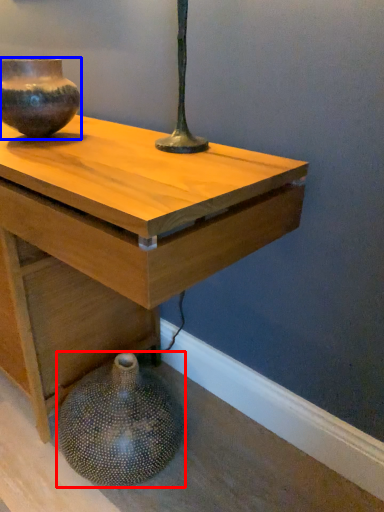
Question: Among these objects, which one is nearest to the camera, vase (highlighted by a red box) or vase (highlighted by a blue box)?

Choices:
 (A) vase
 (B) vase

Answer: (A)